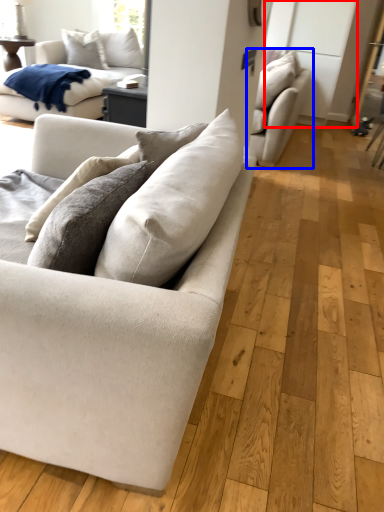
Question: Which object is closer to the camera taking this photo, glass door (highlighted by a red box) or studio couch (highlighted by a blue box)?

Choices:
 (A) glass door
 (B) studio couch

Answer: (B)